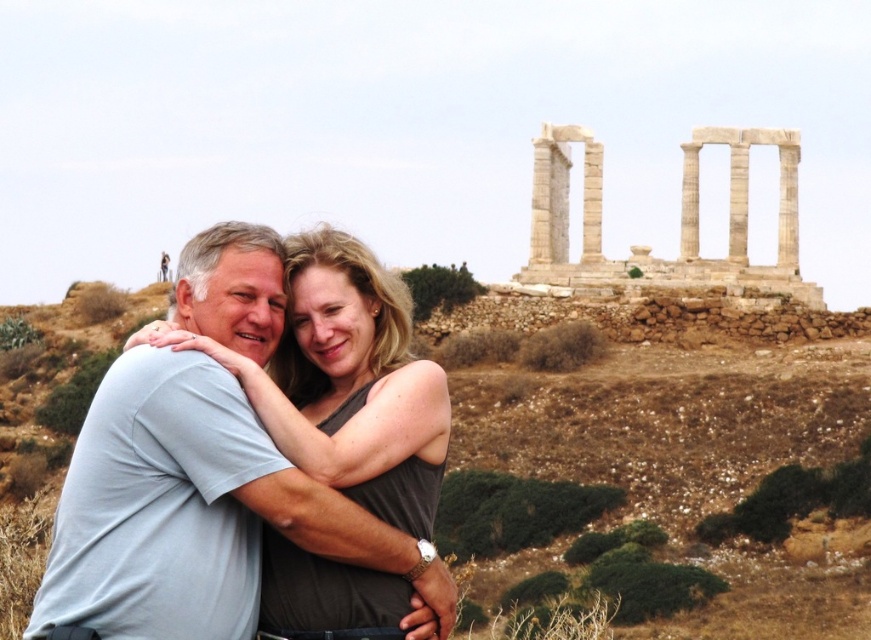
Consider the image. Which is more to the right, brown grassy hillside at lower center or white marble columns at upper center?

Positioned to the right is white marble columns at upper center.

Where is `brown grassy hillside at lower center`? This screenshot has width=871, height=640. brown grassy hillside at lower center is located at coordinates (665, 400).

You are a GUI agent. You are given a task and a screenshot of the screen. Output one action in this format:
    pyautogui.click(x=<x>, y=<y>)
    Task: Click on the brown grassy hillside at lower center
    This screenshot has width=871, height=640.
    Given the screenshot: What is the action you would take?
    pyautogui.click(x=665, y=400)

Where is `matte gray tank top at center`? Image resolution: width=871 pixels, height=640 pixels. matte gray tank top at center is located at coordinates (341, 436).

From the picture: Which is more to the left, matte gray tank top at center or white marble columns at upper center?

Positioned to the left is matte gray tank top at center.

Between point (309, 426) and point (737, 256), which one is positioned behind?

The point (737, 256) is behind.

The image size is (871, 640). In order to click on matte gray tank top at center in this screenshot , I will do `click(341, 436)`.

Is brown grassy hillside at lower center positioned behind matte gray tank top at center?

Yes.

The height and width of the screenshot is (640, 871). Find the location of `brown grassy hillside at lower center`. brown grassy hillside at lower center is located at coordinates (665, 400).